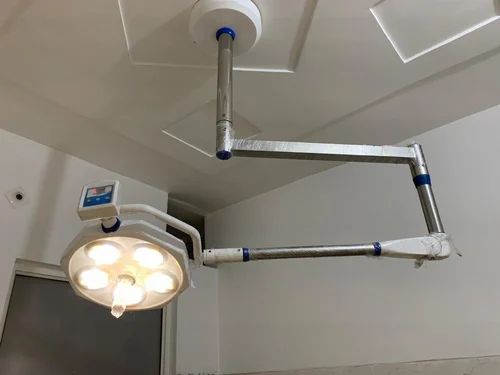
The width and height of the screenshot is (500, 375). I want to click on white ceiling, so click(x=136, y=160).